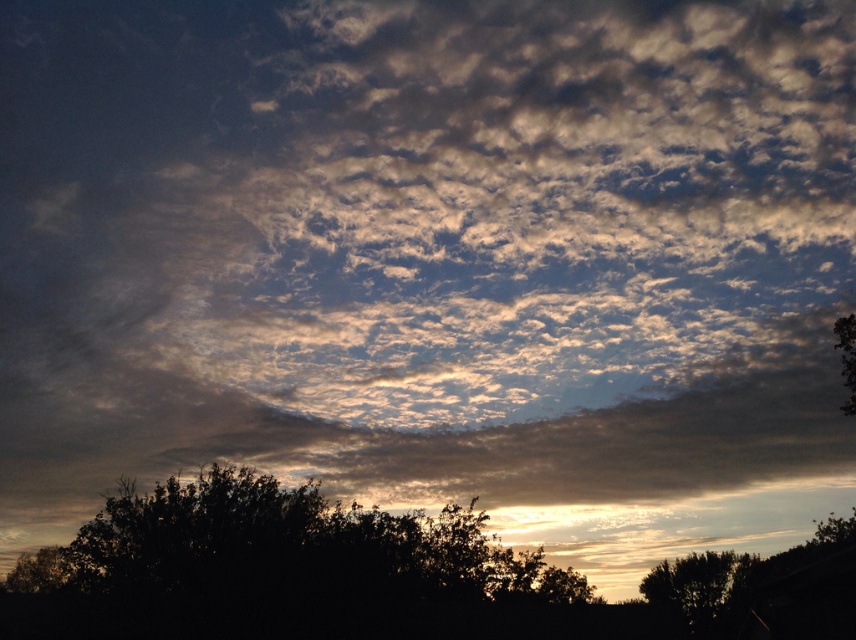
Who is higher up, dark green leafy tree at lower center or silhouette leafy tree at lower right?

dark green leafy tree at lower center is higher up.

Is dark green leafy tree at lower center bigger than silhouette leafy tree at lower right?

Yes, dark green leafy tree at lower center is bigger than silhouette leafy tree at lower right.

Does point (373, 518) come behind point (734, 605)?

No.

Locate an element on the screen. This screenshot has height=640, width=856. dark green leafy tree at lower center is located at coordinates (275, 561).